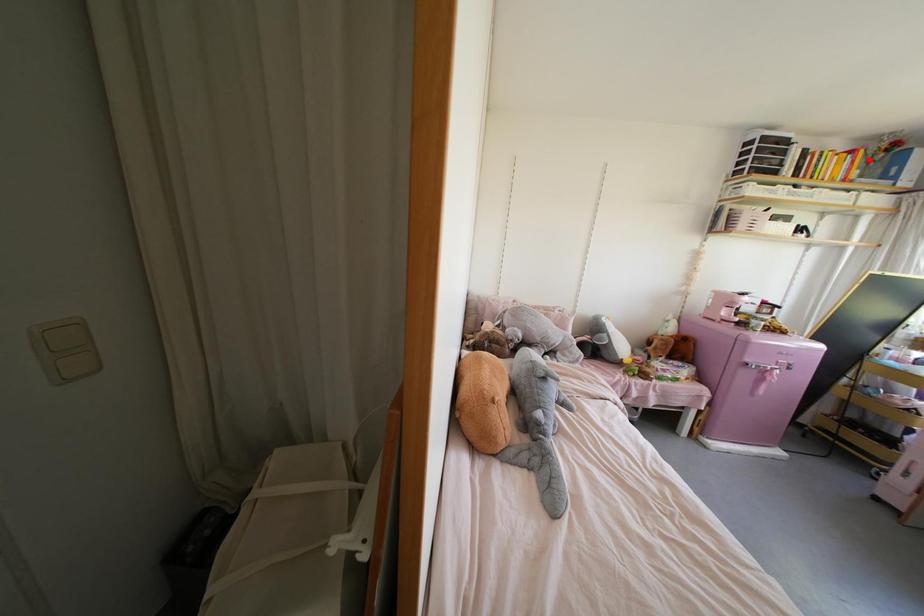
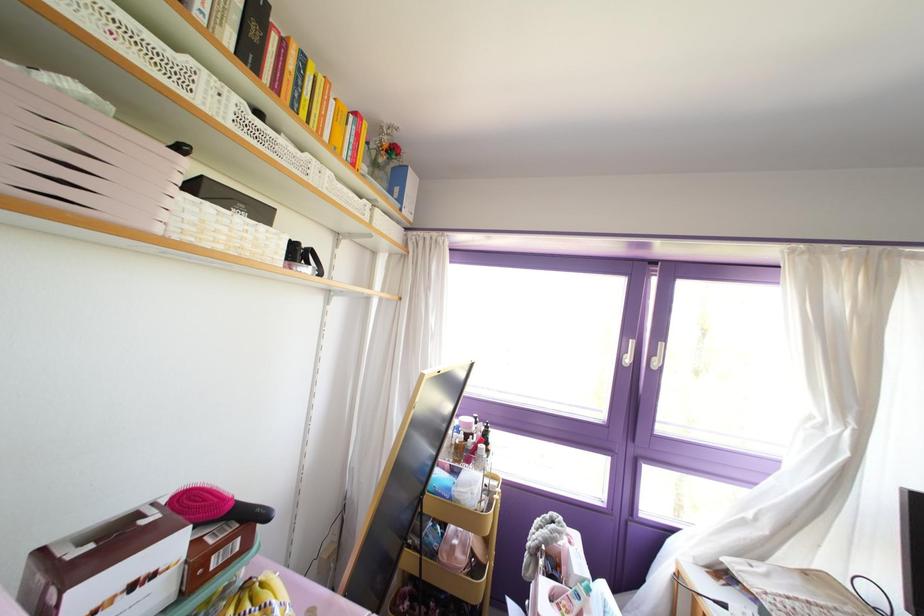
Where in the second image is the point corresponding to the highlighted location from the first image?

(372, 163)